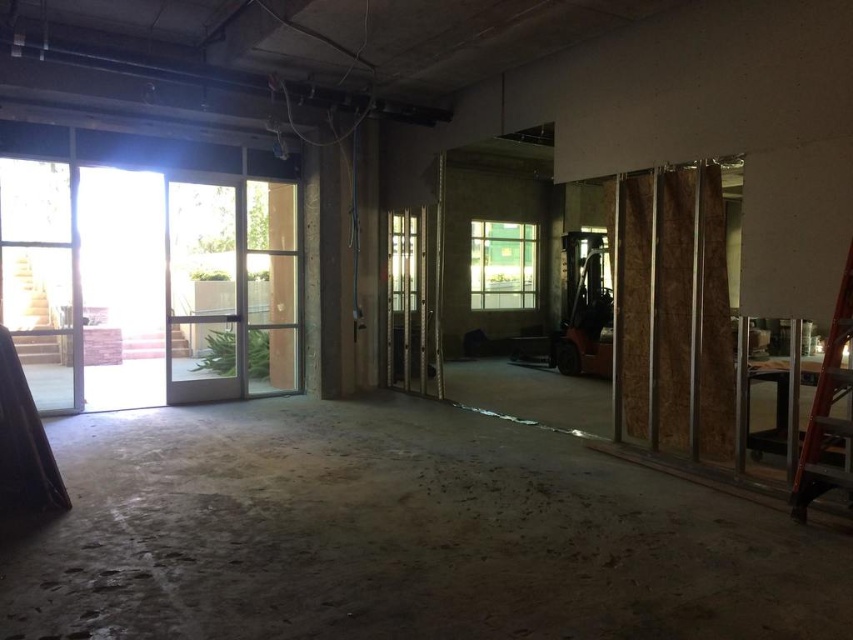
You are a contractor assessing the construction site. You need to determine if the red wood ladder at right can be stored vertically without touching the clear glass door at center. Given that the ladder is 2 meters tall, is this possible?

The clear glass door at center has a greater height compared to the red wood ladder at right, which is 2 meters tall. Since the door is taller, the ladder can be stored vertically without touching the door.